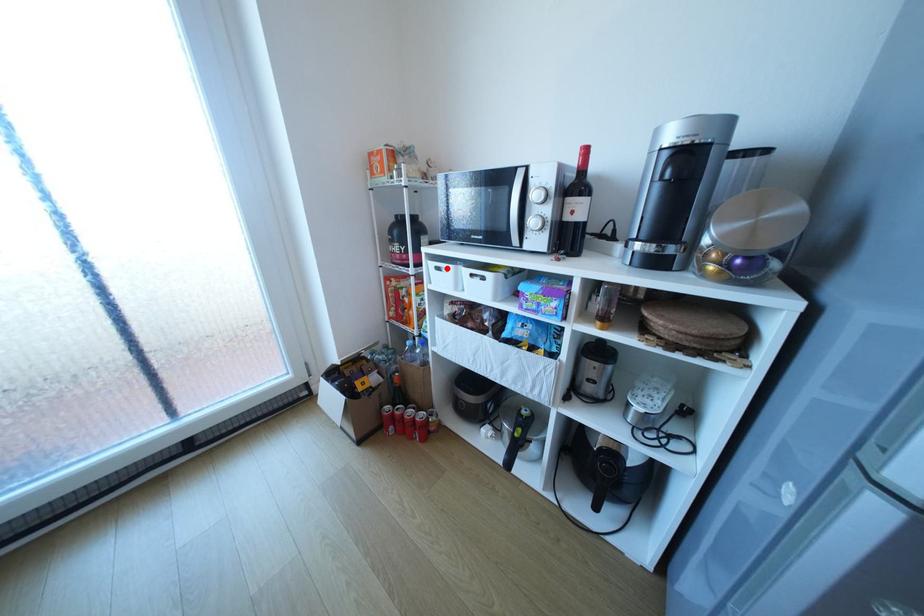
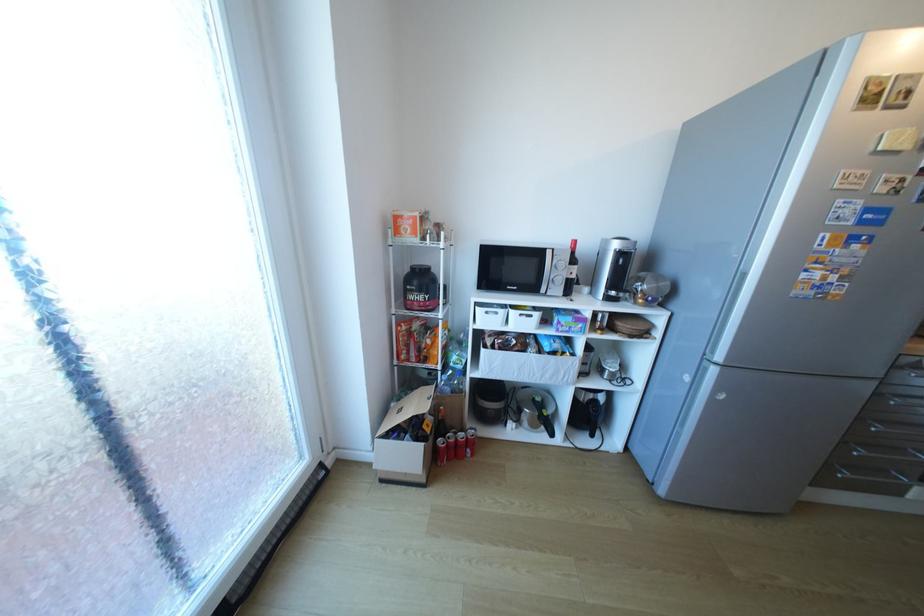
The point at the highlighted location is marked in the first image. Where is the corresponding point in the second image?

(495, 313)